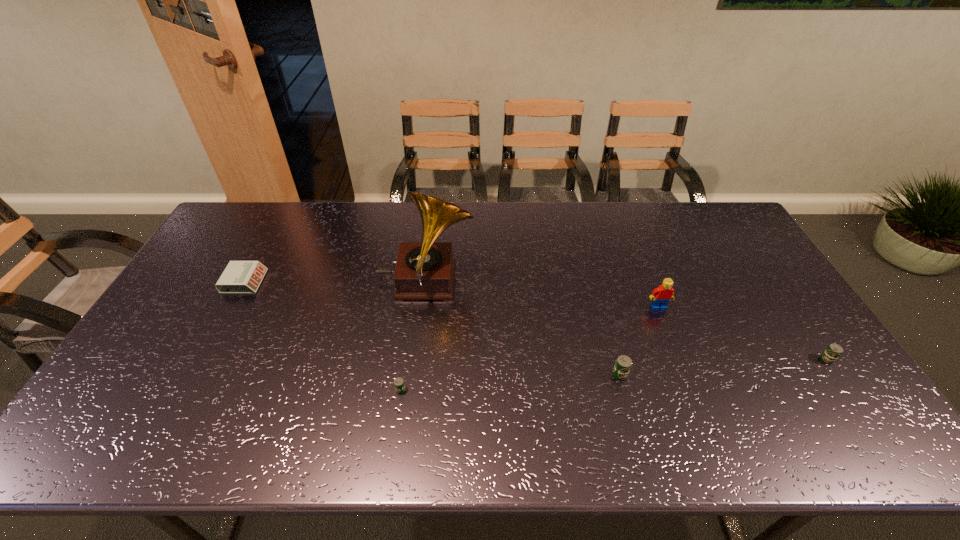
Locate an element on the screen. vacant space at the right edge of the desktop is located at coordinates 808,360.

This screenshot has height=540, width=960. In the image, there is a desktop. In order to click on vacant region at the far left corner in this screenshot , I will do `click(261, 223)`.

Image resolution: width=960 pixels, height=540 pixels. In the image, there is a desktop. What are the coordinates of `free space at the near left corner` in the screenshot? It's located at (167, 395).

Where is `vacant space at the near right corner`? vacant space at the near right corner is located at coordinates coord(803,384).

Identify the location of unoccupied position between the third object from right to left and the shortest beer can. This screenshot has height=540, width=960. (510, 382).

This screenshot has width=960, height=540. I want to click on vacant area that lies between the second shortest beer can and the phonograph record, so click(x=626, y=320).

You are a GUI agent. You are given a task and a screenshot of the screen. Output one action in this format:
    pyautogui.click(x=<x>, y=<y>)
    Task: Click on the empty space that is in between the shortest beer can and the tallest beer can
    
    Given the screenshot: What is the action you would take?
    pyautogui.click(x=510, y=382)

Locate an element on the screen. vacant region between the leftmost object and the tallest object is located at coordinates (335, 281).

The width and height of the screenshot is (960, 540). In order to click on empty space that is in between the rightmost beer can and the Lego in this screenshot , I will do `click(742, 333)`.

Identify the location of vacant space that's between the shortest beer can and the phonograph record. (413, 336).